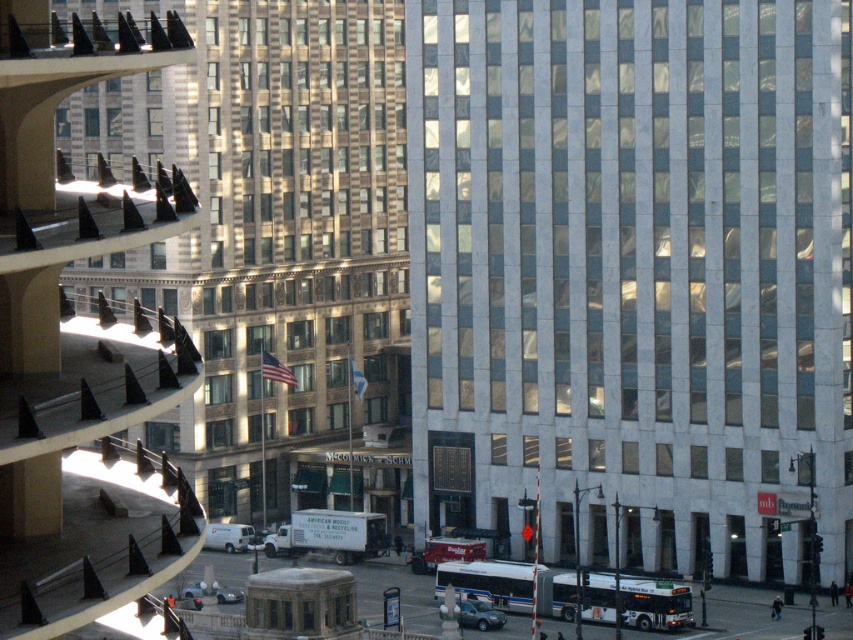
Question: Among these points, which one is farthest from the camera?

Choices:
 (A) (250, 346)
 (B) (428, 28)

Answer: (A)

Question: Among these points, which one is nearest to the camera?

Choices:
 (A) (358, 332)
 (B) (532, 384)

Answer: (B)

Question: Can you confirm if white marble building at center is bigger than gold textured building at center?

Choices:
 (A) no
 (B) yes

Answer: (A)

Question: Is white marble building at center further to camera compared to gold textured building at center?

Choices:
 (A) yes
 (B) no

Answer: (A)

Question: Can you confirm if white marble building at center is bigger than gold textured building at center?

Choices:
 (A) yes
 (B) no

Answer: (B)